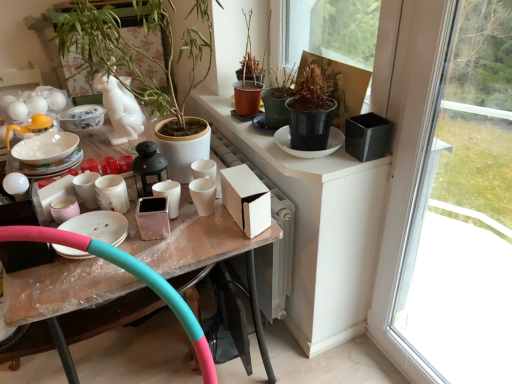
The height and width of the screenshot is (384, 512). Identify the location of free space in front of matte pink ceramic cup at center, the third tableware from the left. (170, 244).